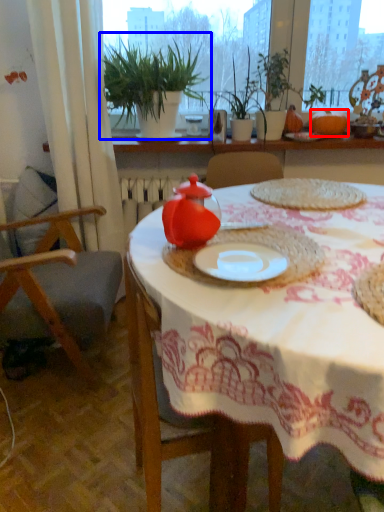
Question: Which object is further to the camera taking this photo, pumpkin (highlighted by a red box) or houseplant (highlighted by a blue box)?

Choices:
 (A) pumpkin
 (B) houseplant

Answer: (A)